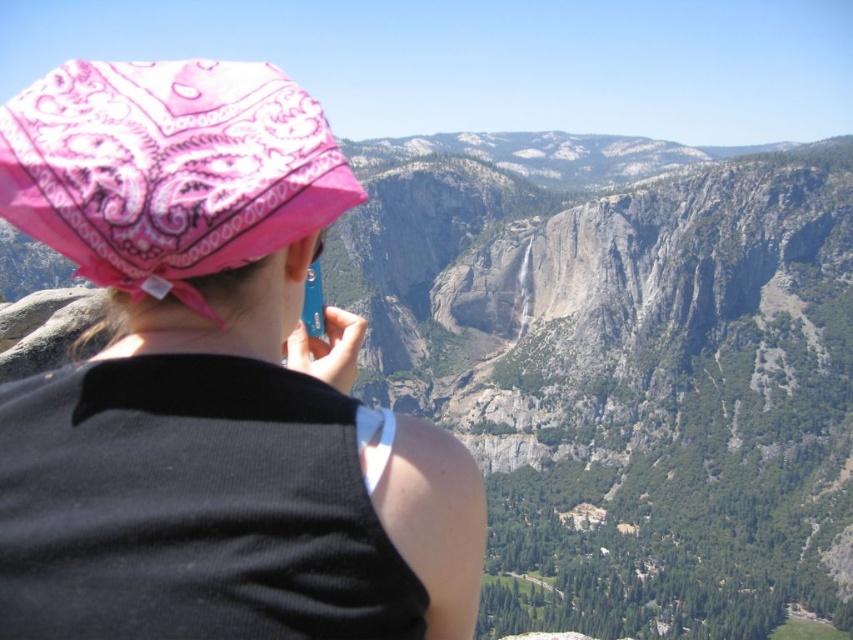
Question: Among these points, which one is farthest from the camera?

Choices:
 (A) (213, 272)
 (B) (285, 540)

Answer: (A)

Question: Which object is closer to the camera taking this photo?

Choices:
 (A) pink paisley bandana at upper left
 (B) pink bandana at center

Answer: (B)

Question: Is pink bandana at center wider than pink paisley bandana at upper left?

Choices:
 (A) no
 (B) yes

Answer: (B)

Question: Can you confirm if pink bandana at center is positioned below pink paisley bandana at upper left?

Choices:
 (A) yes
 (B) no

Answer: (A)

Question: Can you confirm if pink bandana at center is bigger than pink paisley bandana at upper left?

Choices:
 (A) yes
 (B) no

Answer: (A)

Question: Which point is closer to the camera?

Choices:
 (A) (209, 232)
 (B) (219, 125)

Answer: (A)